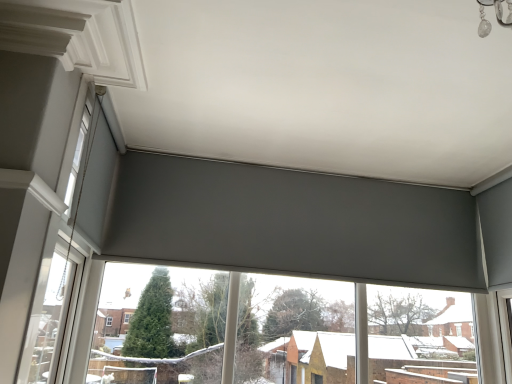
Describe the element at coordinates (294, 331) in the screenshot. The image size is (512, 384). I see `matte gray blind at center` at that location.

Measure the distance between point (464,331) and camera.

They are 3.04 meters apart.

The height and width of the screenshot is (384, 512). Identify the location of matte gray blind at center. (294, 331).

The height and width of the screenshot is (384, 512). In order to click on matte gray blind at center in this screenshot , I will do `click(294, 331)`.